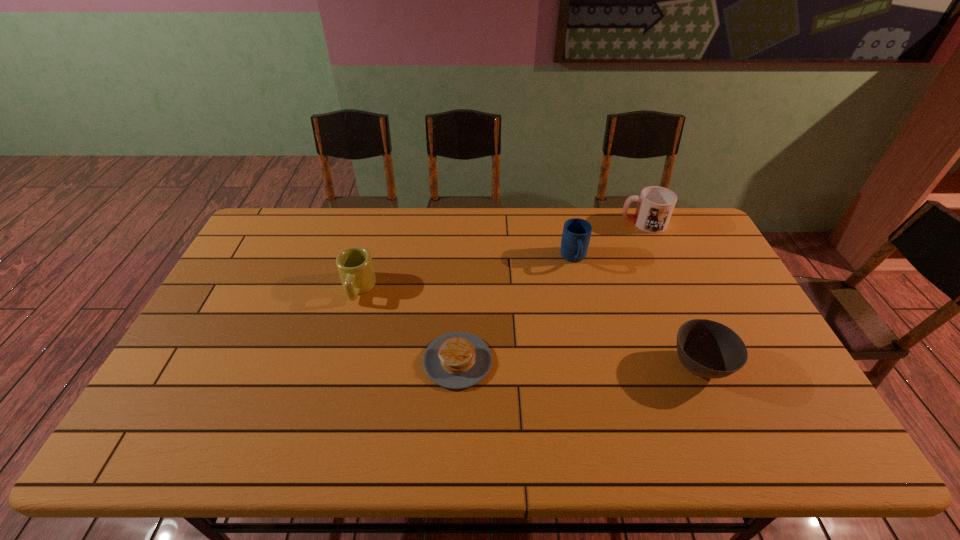
The height and width of the screenshot is (540, 960). Identify the location of unoccupied area between the bowl and the third object from right to left. (636, 313).

In order to click on free space that is in between the leftmost object and the second object from left to right in this screenshot , I will do `click(408, 325)`.

Where is `object that ranks as the fourth closest to the third object from right to left`? The width and height of the screenshot is (960, 540). object that ranks as the fourth closest to the third object from right to left is located at coordinates (354, 264).

Select which object is the third closest to the leftmost mug. Please provide its 2D coordinates. Your answer should be formatted as a tuple, i.e. [(x, y)], where the tuple contains the x and y coordinates of a point satisfying the conditions above.

[(708, 349)]

Choose which mug is the second nearest neighbor to the third object from right to left. Please provide its 2D coordinates. Your answer should be formatted as a tuple, i.e. [(x, y)], where the tuple contains the x and y coordinates of a point satisfying the conditions above.

[(354, 264)]

Identify the location of the closest mug to the bowl. This screenshot has height=540, width=960. coord(576,234).

The width and height of the screenshot is (960, 540). What are the coordinates of `vacant area in the image that satisfies the following two spatial constraints: 1. with the handle on the side of the shortest object; 2. on the left side of the leftmost mug` in the screenshot? It's located at (338, 361).

Identify the location of vacant point that satisfies the following two spatial constraints: 1. on the side of the bowl with the handle; 2. on the left side of the second mug from left to right. pos(598,367).

Identify the location of vacant area that satisfies the following two spatial constraints: 1. on the side of the rightmost mug with the handle; 2. on the side of the second mug from left to right with the handle. (659, 259).

Identify the location of free spot that satisfies the following two spatial constraints: 1. on the front side of the bowl; 2. on the left side of the pancake. (458, 367).